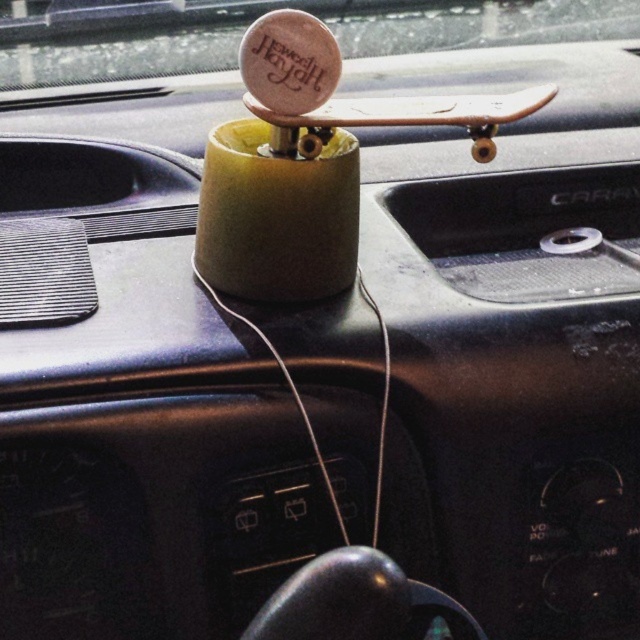
Is wooden circle at upper center to the right of wooden skateboard at center from the viewer's perspective?

No, wooden circle at upper center is not to the right of wooden skateboard at center.

Is point (458, 45) positioned behind point (410, 116)?

Yes, point (458, 45) is farther from viewer.

Which is behind, point (600, 3) or point (497, 125)?

The point (600, 3) is more distant.

I want to click on wooden circle at upper center, so click(x=260, y=13).